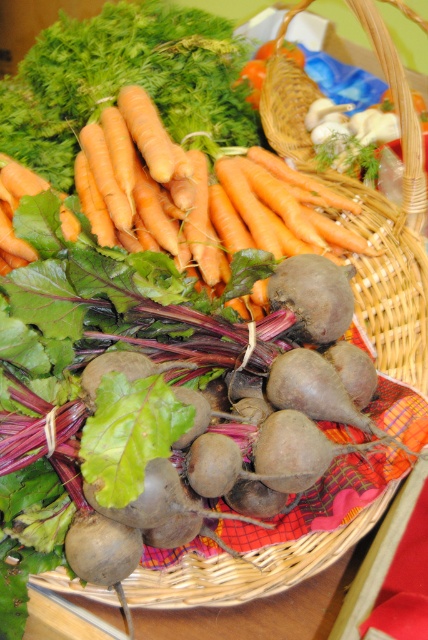
Question: Among these points, which one is farthest from the camera?

Choices:
 (A) (407, 308)
 (B) (17, 163)

Answer: (A)

Question: Is orange smooth carrot at upper center smaller than woven wicker basket at center?

Choices:
 (A) no
 (B) yes

Answer: (B)

Question: Can you confirm if orange smooth carrot at upper center is positioned to the left of woven wicker basket at center?

Choices:
 (A) no
 (B) yes

Answer: (B)

Question: Can you confirm if orange smooth carrot at upper center is thinner than woven wicker basket at center?

Choices:
 (A) no
 (B) yes

Answer: (A)

Question: Which point is farther from the camera taking this photo?

Choices:
 (A) (165, 234)
 (B) (353, 3)

Answer: (A)